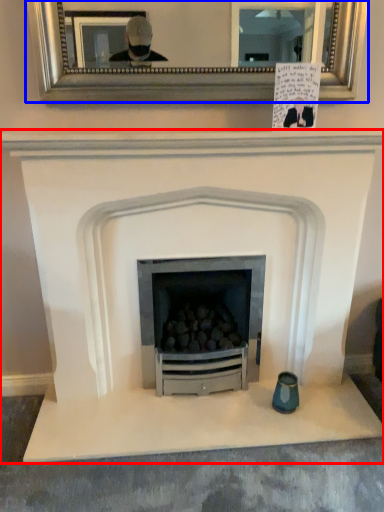
Question: Which object appears farthest to the camera in this image, fireplace (highlighted by a red box) or picture frame (highlighted by a blue box)?

Choices:
 (A) fireplace
 (B) picture frame

Answer: (B)